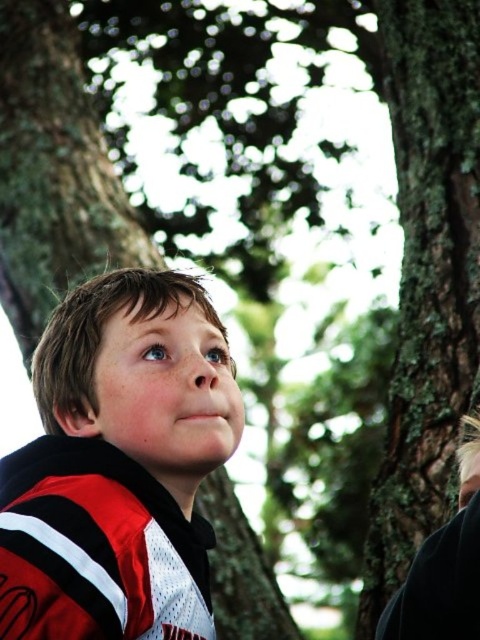
You are a photographer adjusting your camera focus. You want to ensure both the red and white jersey at center and the green mossy bark at right are in focus. Given their positions, which object should you focus on first to achieve a sharp image of both?

You should focus on the red and white jersey at center first because it is closer to the viewer than the green mossy bark at right, allowing the depth of field to extend backward to include the bark in focus.

You are a photographer trying to capture the boy in the image while ensuring both the red and white jersey at center and the green mossy bark at right are visible. Which object should you focus on to ensure the boy and the taller one are in frame?

The green mossy bark at right is taller than the red and white jersey at center, so you should focus on the green mossy bark at right to ensure both the boy and the taller object are in frame.

Consider the image. You are standing in the scene looking at the boy and the trees. There are two points marked in the image. The first point is at coordinates point (216, 397) and the second is at point (392, 561). Which point is closer to you?

Point (216, 397) is closer to the camera than point (392, 561).